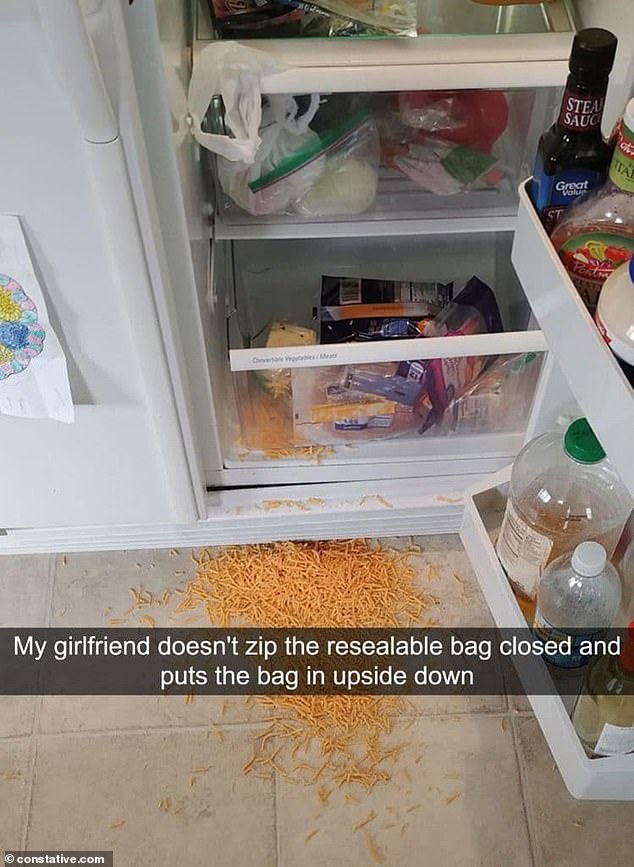
At what (x,y) coordinates should I click in order to perform the action: click on white door shelf. Please return your answer as a coordinate pair (x, y). Looking at the image, I should click on pyautogui.click(x=597, y=357), pyautogui.click(x=493, y=590).